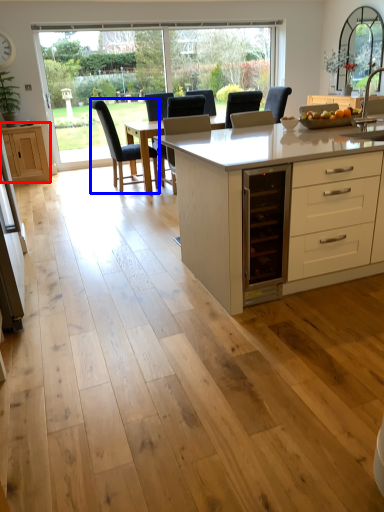
Question: Which of the following is the closest to the observer, cabinetry (highlighted by a red box) or chair (highlighted by a blue box)?

Choices:
 (A) cabinetry
 (B) chair

Answer: (B)